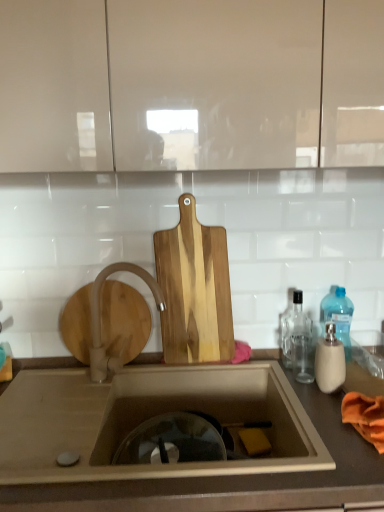
Question: Is blue translucent bottle at right, the 1th bottle in the back-to-front sequence, thinner than beige matte soap dispenser at right, marked as the third bottle in a back-to-front arrangement?

Choices:
 (A) no
 (B) yes

Answer: (A)

Question: From a real-world perspective, is blue translucent bottle at right, the 1th bottle in the back-to-front sequence, physically above beige matte soap dispenser at right, marked as the third bottle in a back-to-front arrangement?

Choices:
 (A) yes
 (B) no

Answer: (A)

Question: Considering the relative sizes of blue translucent bottle at right, the 1th bottle in the back-to-front sequence, and beige matte soap dispenser at right, arranged as the first bottle when viewed from the front, in the image provided, is blue translucent bottle at right, the 1th bottle in the back-to-front sequence, shorter than beige matte soap dispenser at right, arranged as the first bottle when viewed from the front,?

Choices:
 (A) no
 (B) yes

Answer: (A)

Question: Is blue translucent bottle at right, the 3th bottle when ordered from front to back, oriented towards beige matte soap dispenser at right, arranged as the first bottle when viewed from the front?

Choices:
 (A) no
 (B) yes

Answer: (A)

Question: From a real-world perspective, is blue translucent bottle at right, the 3th bottle when ordered from front to back, under beige matte soap dispenser at right, marked as the third bottle in a back-to-front arrangement?

Choices:
 (A) yes
 (B) no

Answer: (B)

Question: Would you consider blue translucent bottle at right, the 3th bottle when ordered from front to back, to be distant from beige matte soap dispenser at right, arranged as the first bottle when viewed from the front?

Choices:
 (A) no
 (B) yes

Answer: (A)

Question: Does blue translucent bottle at right, the 1th bottle in the back-to-front sequence, appear on the left side of natural wood cutting board at center?

Choices:
 (A) no
 (B) yes

Answer: (A)

Question: From the image's perspective, is blue translucent bottle at right, the 3th bottle when ordered from front to back, over natural wood cutting board at center?

Choices:
 (A) no
 (B) yes

Answer: (A)

Question: Can you see blue translucent bottle at right, the 1th bottle in the back-to-front sequence, touching natural wood cutting board at center?

Choices:
 (A) no
 (B) yes

Answer: (A)

Question: Does blue translucent bottle at right, the 3th bottle when ordered from front to back, have a lesser height compared to natural wood cutting board at center?

Choices:
 (A) no
 (B) yes

Answer: (B)

Question: Is blue translucent bottle at right, the 3th bottle when ordered from front to back, positioned with its back to natural wood cutting board at center?

Choices:
 (A) yes
 (B) no

Answer: (B)

Question: From a real-world perspective, is blue translucent bottle at right, the 3th bottle when ordered from front to back, located higher than natural wood cutting board at center?

Choices:
 (A) yes
 (B) no

Answer: (B)

Question: From a real-world perspective, does transparent glass bottle at right, which ranks as the 2th bottle in back-to-front order, sit lower than matte white cabinet at upper center?

Choices:
 (A) yes
 (B) no

Answer: (A)